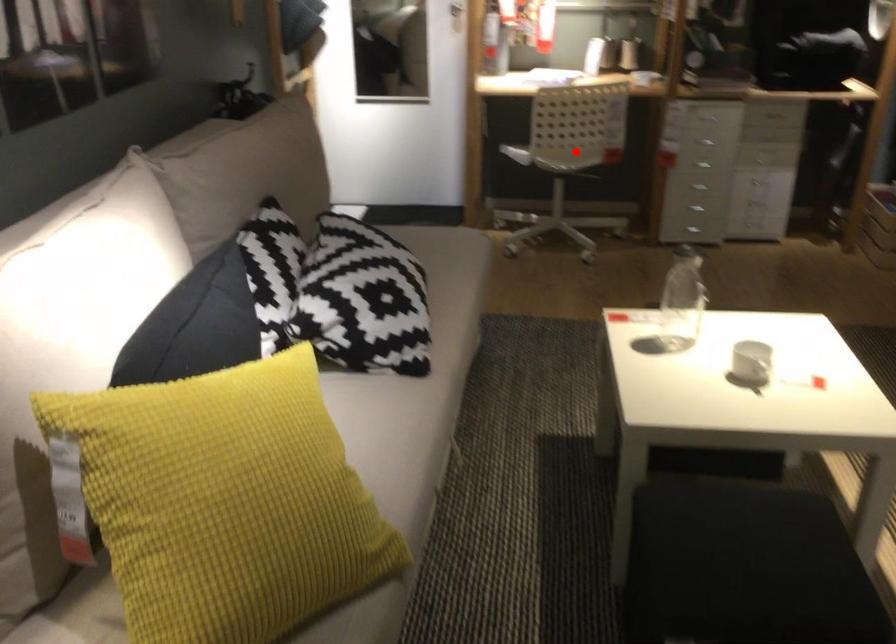
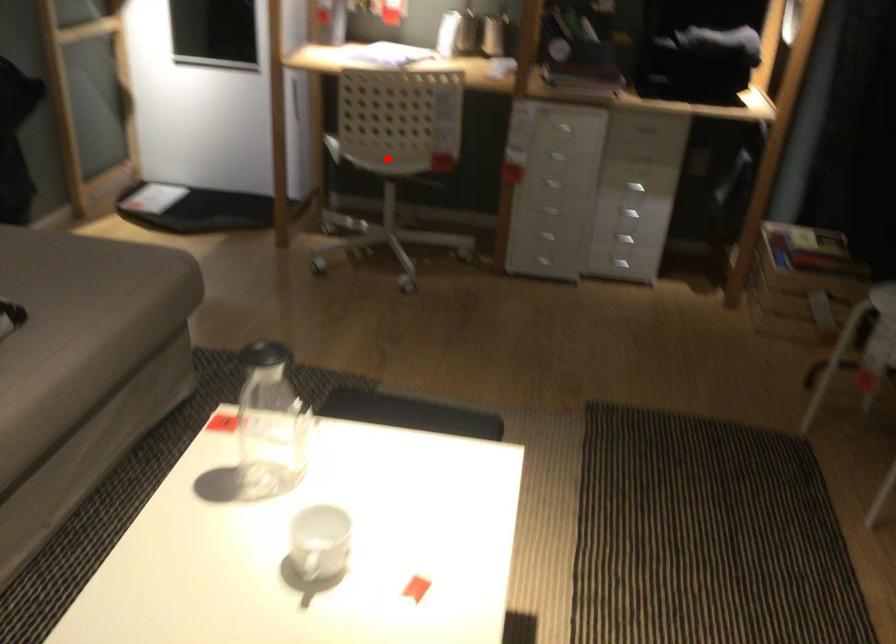
I am providing you with two images of the same scene from different viewpoints. A red point is marked on the first image and another point is marked on the second image. Do the highlighted points in image1 and image2 indicate the same real-world spot?

Yes